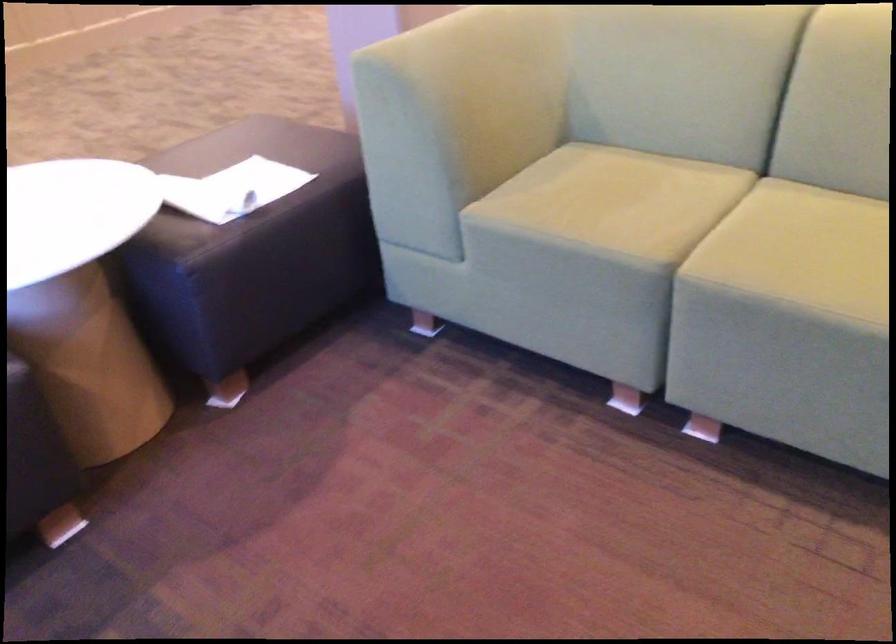
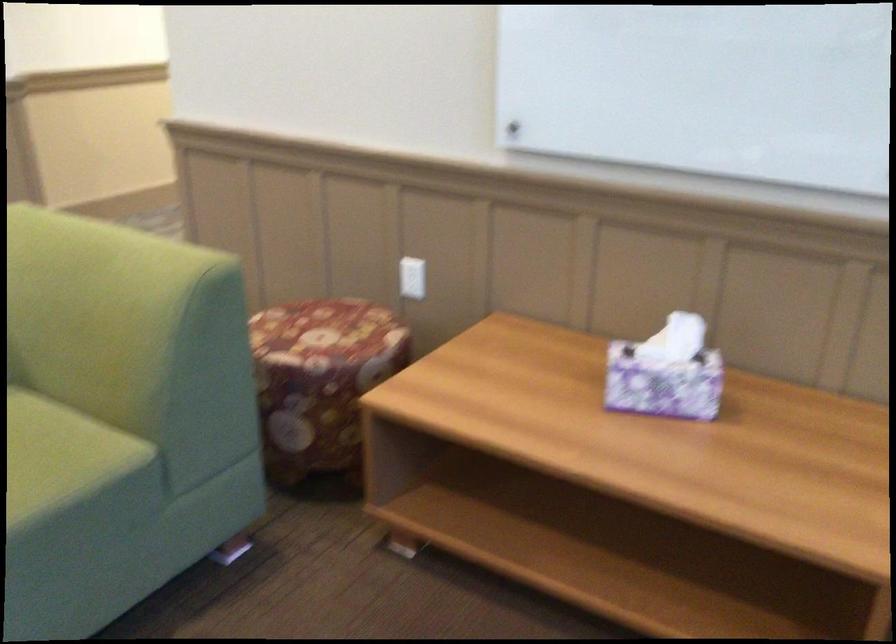
The images are taken continuously from a first-person perspective. In which direction is your viewpoint rotating?

The rotation direction of the camera is right-down.